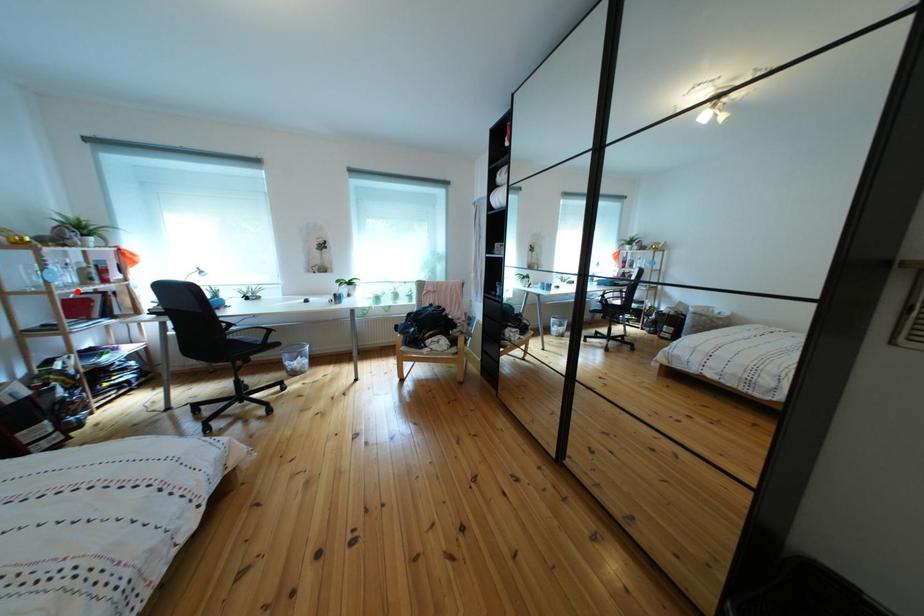
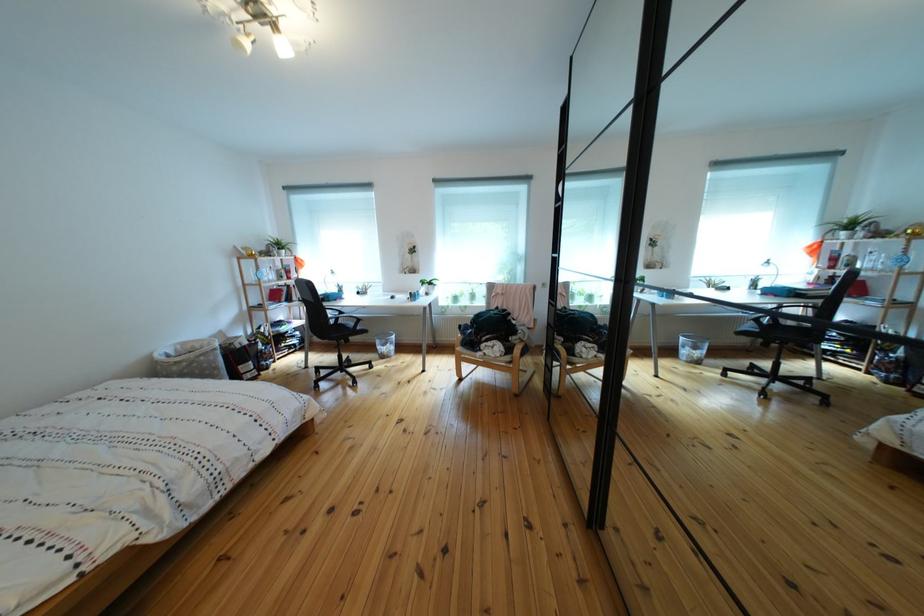
The point at the highlighted location is marked in the first image. Where is the corresponding point in the second image?

(282, 286)